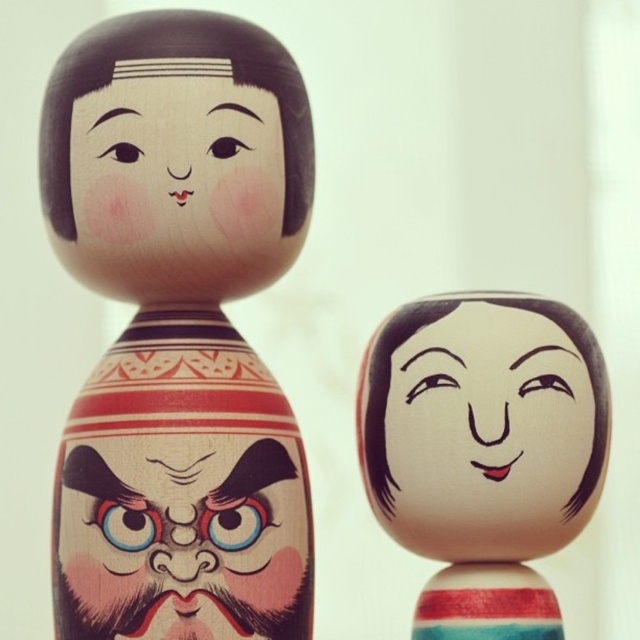
Question: Is smooth beige face at center above smooth wood face at center?

Choices:
 (A) no
 (B) yes

Answer: (A)

Question: Estimate the real-world distances between objects in this image. Which object is farther from the smooth beige face at center?

Choices:
 (A) wooden doll at center
 (B) wooden painted mask at center
 (C) smooth wood face at center

Answer: (C)

Question: Which of these objects is positioned closest to the wooden painted mask at center?

Choices:
 (A) wooden doll at center
 (B) smooth beige face at center

Answer: (A)

Question: Is smooth beige face at center smaller than smooth wood face at center?

Choices:
 (A) yes
 (B) no

Answer: (B)

Question: Is wooden doll at center smaller than wooden painted mask at center?

Choices:
 (A) no
 (B) yes

Answer: (A)

Question: Which of the following is the closest to the observer?

Choices:
 (A) coord(241,237)
 (B) coord(289,589)
 (C) coord(561,464)
 (D) coord(147,134)

Answer: (D)